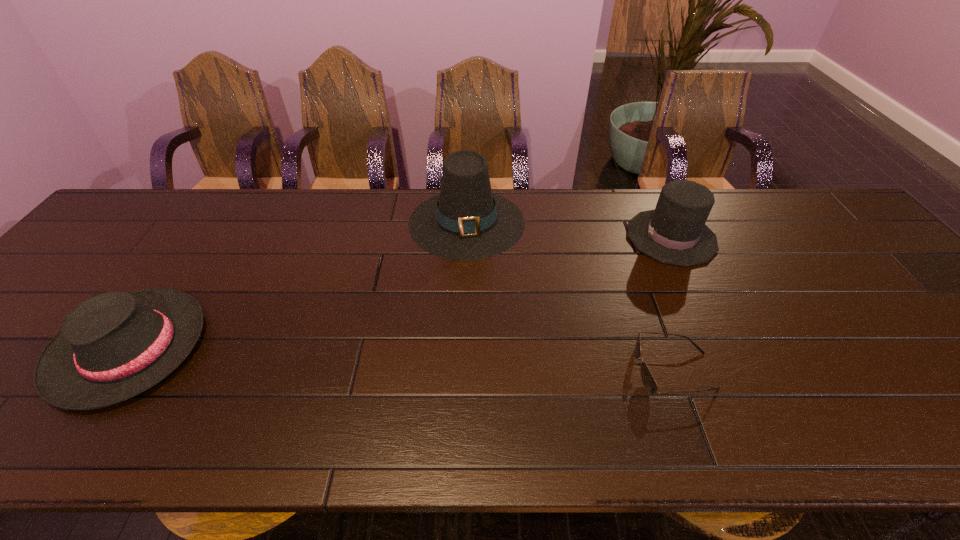
Find the location of a particular element. vacant area that lies between the third tallest object and the tallest dress hat is located at coordinates (298, 285).

The width and height of the screenshot is (960, 540). Find the location of `free space between the second object from left to right and the shortest dress hat`. free space between the second object from left to right and the shortest dress hat is located at coordinates (298, 285).

Image resolution: width=960 pixels, height=540 pixels. What are the coordinates of `vacant space in between the second dress hat from left to right and the sunglasses` in the screenshot? It's located at (570, 296).

Image resolution: width=960 pixels, height=540 pixels. I want to click on the second closest object to the second tallest dress hat, so click(x=466, y=221).

Locate an element on the screen. the second closest object to the rightmost dress hat is located at coordinates (466, 221).

Identify which dress hat is located as the nearest to the tallest dress hat. Please provide its 2D coordinates. Your answer should be formatted as a tuple, i.e. [(x, y)], where the tuple contains the x and y coordinates of a point satisfying the conditions above.

[(675, 233)]

Choose which dress hat is the second nearest neighbor to the sunglasses. Please provide its 2D coordinates. Your answer should be formatted as a tuple, i.e. [(x, y)], where the tuple contains the x and y coordinates of a point satisfying the conditions above.

[(466, 221)]